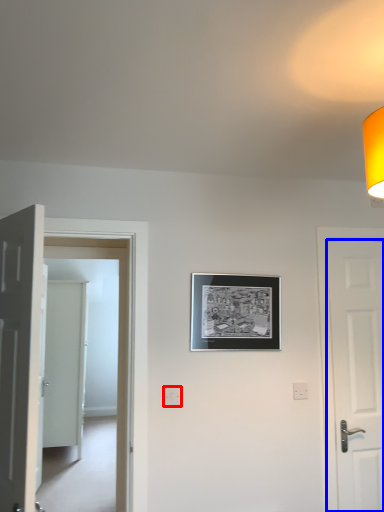
Question: Which of the following is the farthest to the observer, electric outlet (highlighted by a red box) or door (highlighted by a blue box)?

Choices:
 (A) electric outlet
 (B) door

Answer: (B)